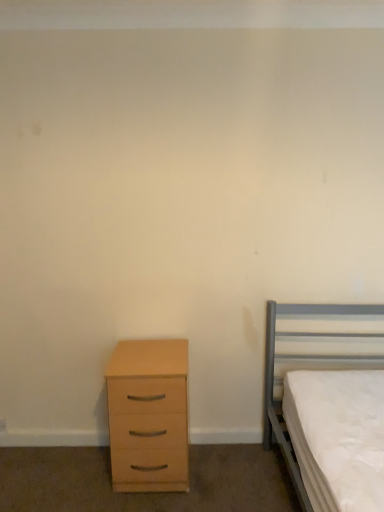
I want to click on free space to the left of light wood/veneer chest of drawers at lower left, so click(x=77, y=475).